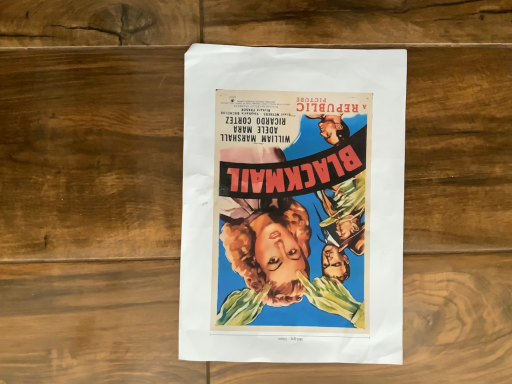
Find the location of a particular element. The width and height of the screenshot is (512, 384). free point above vibrant paper poster at center (from a real-world perspective) is located at coordinates (300, 208).